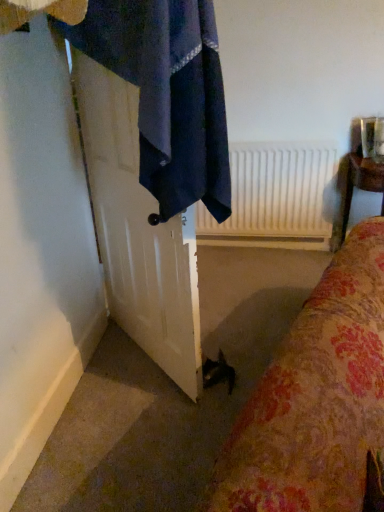
Question: Would you say white glossy door at left is part of white matte radiator at upper center's contents?

Choices:
 (A) no
 (B) yes

Answer: (A)

Question: Does white matte radiator at upper center have a greater height compared to white glossy door at left?

Choices:
 (A) no
 (B) yes

Answer: (A)

Question: Does white matte radiator at upper center come in front of white glossy door at left?

Choices:
 (A) no
 (B) yes

Answer: (A)

Question: Is there a large distance between white matte radiator at upper center and white glossy door at left?

Choices:
 (A) yes
 (B) no

Answer: (A)

Question: Considering the relative positions of white matte radiator at upper center and white glossy door at left in the image provided, is white matte radiator at upper center to the left of white glossy door at left from the viewer's perspective?

Choices:
 (A) no
 (B) yes

Answer: (A)

Question: In terms of height, does dark blue fabric towel at upper left look taller or shorter compared to white matte radiator at upper center?

Choices:
 (A) short
 (B) tall

Answer: (B)

Question: Looking at their shapes, would you say dark blue fabric towel at upper left is wider or thinner than white matte radiator at upper center?

Choices:
 (A) wide
 (B) thin

Answer: (A)

Question: Is point (82, 44) closer or farther from the camera than point (271, 200)?

Choices:
 (A) closer
 (B) farther

Answer: (A)

Question: From a real-world perspective, is dark blue fabric towel at upper left physically located above or below white matte radiator at upper center?

Choices:
 (A) above
 (B) below

Answer: (A)

Question: From a real-world perspective, is white glossy door at left above or below white matte radiator at upper center?

Choices:
 (A) below
 (B) above

Answer: (B)

Question: From the image's perspective, is white glossy door at left above or below white matte radiator at upper center?

Choices:
 (A) above
 (B) below

Answer: (B)

Question: Considering the relative positions of white glossy door at left and white matte radiator at upper center in the image provided, is white glossy door at left to the left or to the right of white matte radiator at upper center?

Choices:
 (A) right
 (B) left

Answer: (B)

Question: Is white glossy door at left inside the boundaries of white matte radiator at upper center, or outside?

Choices:
 (A) inside
 (B) outside

Answer: (B)

Question: From a real-world perspective, is white matte radiator at upper center physically located above or below white glossy door at left?

Choices:
 (A) above
 (B) below

Answer: (B)

Question: Is point (301, 199) closer or farther from the camera than point (104, 72)?

Choices:
 (A) closer
 (B) farther

Answer: (B)